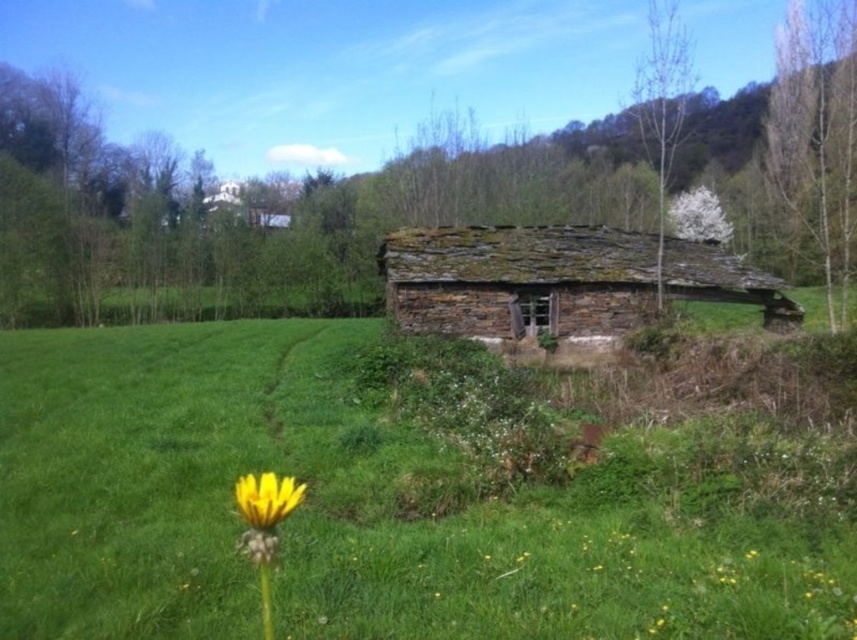
Question: Does rusty stone log cabin at center have a lesser width compared to yellow matte flower at lower left?

Choices:
 (A) no
 (B) yes

Answer: (A)

Question: Is green grassy at center wider than yellow matte flower at lower left?

Choices:
 (A) no
 (B) yes

Answer: (B)

Question: Does rusty stone log cabin at center have a larger size compared to yellow matte flower at lower left?

Choices:
 (A) no
 (B) yes

Answer: (B)

Question: Which of the following is the farthest from the observer?

Choices:
 (A) yellow matte flower at lower left
 (B) green grassy at center
 (C) rusty stone log cabin at center

Answer: (C)

Question: Estimate the real-world distances between objects in this image. Which object is closer to the yellow matte flower at lower left?

Choices:
 (A) rusty stone log cabin at center
 (B) green grassy at center

Answer: (B)

Question: Estimate the real-world distances between objects in this image. Which object is farther from the green grassy at center?

Choices:
 (A) yellow matte flower at lower left
 (B) rusty stone log cabin at center

Answer: (B)